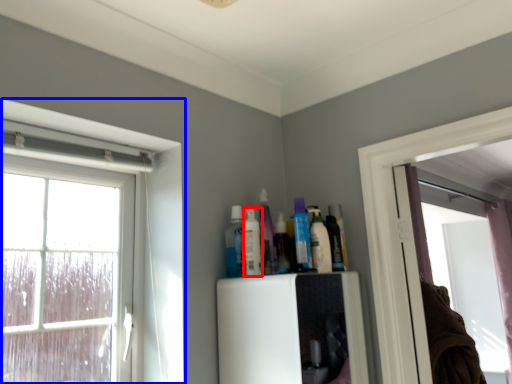
Question: Among these objects, which one is farthest to the camera, toiletry (highlighted by a red box) or window (highlighted by a blue box)?

Choices:
 (A) toiletry
 (B) window

Answer: (A)